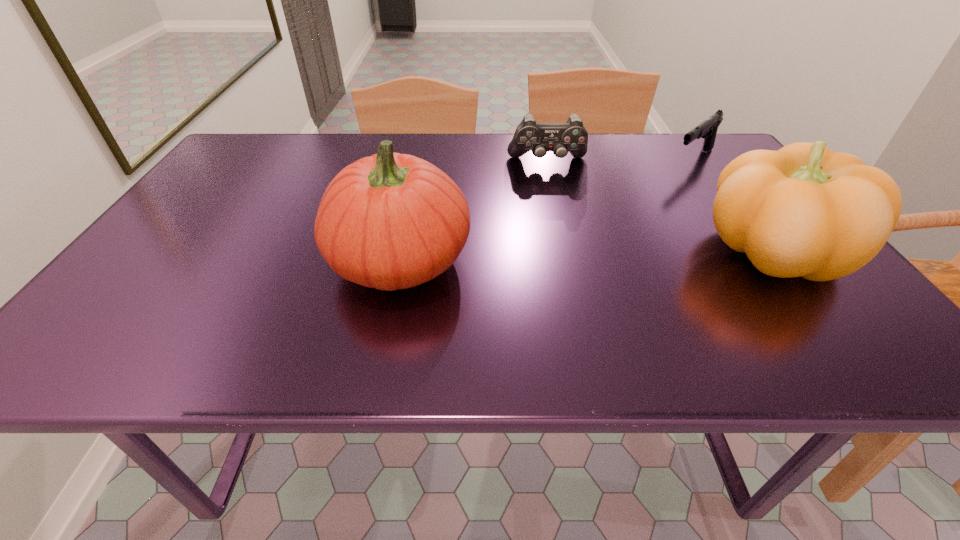
Locate an element on the screen. The width and height of the screenshot is (960, 540). the closest object relative to the right pumpkin is located at coordinates (707, 129).

This screenshot has width=960, height=540. Find the location of `object that can be found as the third closest to the leftmost object`. object that can be found as the third closest to the leftmost object is located at coordinates (707, 129).

At what (x,y) coordinates should I click in order to perform the action: click on blank space that satisfies the following two spatial constraints: 1. on the back side of the right pumpkin; 2. on the left side of the left pumpkin. Please return your answer as a coordinate pair (x, y). This screenshot has width=960, height=540. Looking at the image, I should click on (401, 252).

Find the location of a particular element. This screenshot has height=540, width=960. free space that satisfies the following two spatial constraints: 1. on the back side of the leftmost object; 2. on the left side of the gun is located at coordinates (420, 159).